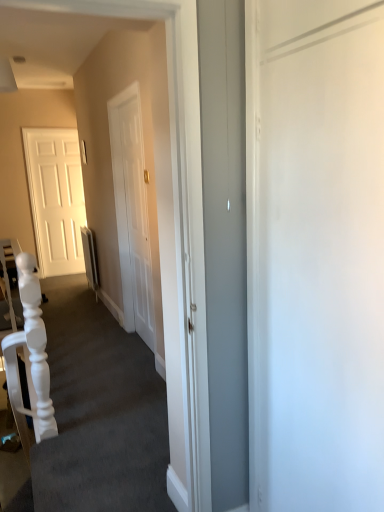
Question: Considering the relative positions of white glossy door at left and white matte armchair at left in the image provided, is white glossy door at left to the right of white matte armchair at left from the viewer's perspective?

Choices:
 (A) yes
 (B) no

Answer: (B)

Question: Is white glossy door at left turned away from white matte armchair at left?

Choices:
 (A) yes
 (B) no

Answer: (B)

Question: From the image's perspective, is white glossy door at left on top of white matte armchair at left?

Choices:
 (A) no
 (B) yes

Answer: (B)

Question: Is white glossy door at left shorter than white matte armchair at left?

Choices:
 (A) yes
 (B) no

Answer: (B)

Question: Is white glossy door at left positioned behind white matte armchair at left?

Choices:
 (A) no
 (B) yes

Answer: (B)

Question: In terms of height, does white matte stairwell at center look taller or shorter compared to white matte armchair at left?

Choices:
 (A) short
 (B) tall

Answer: (A)

Question: Is white matte stairwell at center situated inside white matte armchair at left or outside?

Choices:
 (A) outside
 (B) inside

Answer: (A)

Question: From a real-world perspective, is white matte stairwell at center positioned above or below white matte armchair at left?

Choices:
 (A) above
 (B) below

Answer: (B)

Question: From the image's perspective, is white matte stairwell at center above or below white matte armchair at left?

Choices:
 (A) above
 (B) below

Answer: (B)

Question: From a real-world perspective, relative to white matte stairwell at center, is white glossy door at left vertically above or below?

Choices:
 (A) above
 (B) below

Answer: (A)

Question: From the image's perspective, is white glossy door at left positioned above or below white matte stairwell at center?

Choices:
 (A) below
 (B) above

Answer: (B)

Question: In the image, is white glossy door at left positioned in front of or behind white matte stairwell at center?

Choices:
 (A) front
 (B) behind

Answer: (B)

Question: In the image, is white glossy door at left on the left side or the right side of white matte stairwell at center?

Choices:
 (A) right
 (B) left

Answer: (B)

Question: Relative to white matte armchair at left, is white glossy door at left in front or behind?

Choices:
 (A) front
 (B) behind

Answer: (B)

Question: Based on their sizes in the image, would you say white glossy door at left is bigger or smaller than white matte armchair at left?

Choices:
 (A) big
 (B) small

Answer: (B)